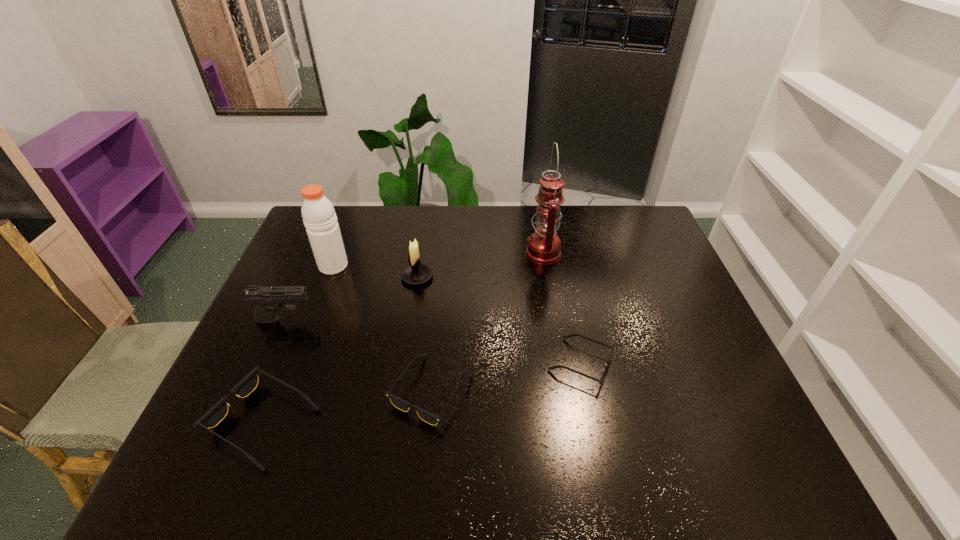
I want to click on free space that satisfies the following two spatial constraints: 1. on the lenses of the shortest object; 2. on the lenses of the second sunglasses from right to left, so click(x=587, y=391).

Identify the location of blank area in the image that satisfies the following two spatial constraints: 1. on the lenses of the shortest object; 2. on the lenses of the second tallest sunglasses. Image resolution: width=960 pixels, height=540 pixels. (587, 391).